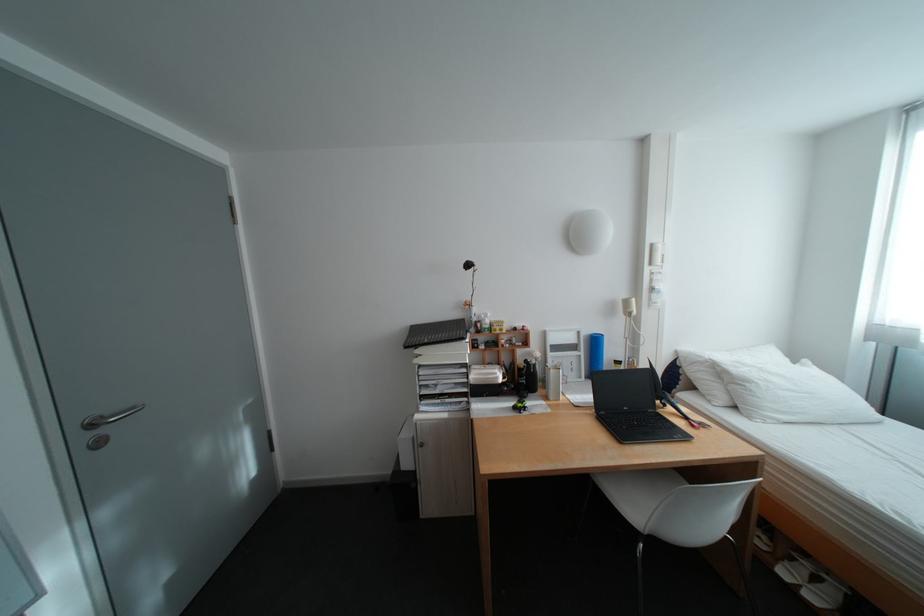
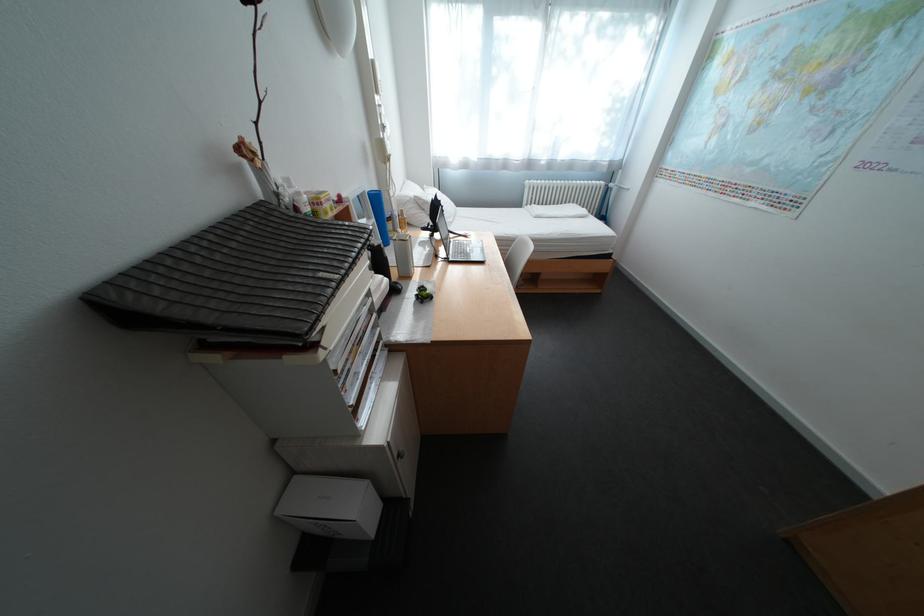
Find the pixel in the second image that matches (713,361) in the first image.

(420, 200)